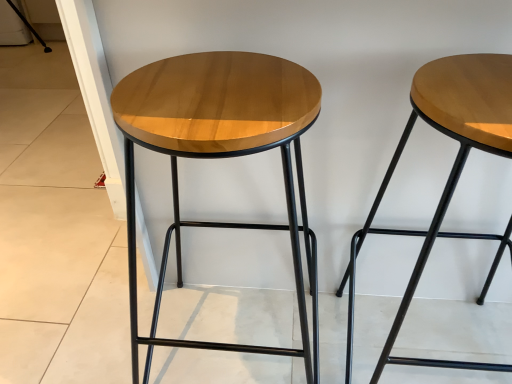
What do you see at coordinates (450, 173) in the screenshot? Image resolution: width=512 pixels, height=384 pixels. I see `wooden stool at upper right, acting as the 2th stool starting from the left` at bounding box center [450, 173].

Find the location of a particular element. wooden stool at upper right, acting as the 2th stool starting from the left is located at coordinates (450, 173).

What is the approximate width of wooden stool at upper right, acting as the 2th stool starting from the left?

15.60 inches.

What is the approximate width of wooden stool at center, arranged as the first stool when viewed from the left?

It is 15.86 inches.

I want to click on wooden stool at center, the 2th stool from the right, so click(x=220, y=153).

Describe the element at coordinates (220, 153) in the screenshot. I see `wooden stool at center, arranged as the first stool when viewed from the left` at that location.

Identify the location of wooden stool at upper right, acting as the 2th stool starting from the left. The height and width of the screenshot is (384, 512). (450, 173).

Which is more to the right, wooden stool at upper right, the 1th stool from the right, or wooden stool at center, the 2th stool from the right?

From the viewer's perspective, wooden stool at upper right, the 1th stool from the right, appears more on the right side.

Considering the relative positions of wooden stool at upper right, acting as the 2th stool starting from the left, and wooden stool at center, arranged as the first stool when viewed from the left, in the image provided, is wooden stool at upper right, acting as the 2th stool starting from the left, in front of wooden stool at center, arranged as the first stool when viewed from the left,?

Yes, it is in front of wooden stool at center, arranged as the first stool when viewed from the left.

Considering the positions of point (372, 207) and point (320, 98), is point (372, 207) closer or farther from the camera than point (320, 98)?

Clearly, point (372, 207) is more distant from the camera than point (320, 98).

From the image's perspective, which one is positioned lower, wooden stool at upper right, the 1th stool from the right, or wooden stool at center, the 2th stool from the right?

From the image's view, wooden stool at upper right, the 1th stool from the right, is below.

From a real-world perspective, which object stands above the other?

wooden stool at center, the 2th stool from the right, is physically above.

Is wooden stool at upper right, the 1th stool from the right, thinner than wooden stool at center, arranged as the first stool when viewed from the left?

Correct, the width of wooden stool at upper right, the 1th stool from the right, is less than that of wooden stool at center, arranged as the first stool when viewed from the left.

Can you confirm if wooden stool at upper right, the 1th stool from the right, is shorter than wooden stool at center, the 2th stool from the right?

Indeed, wooden stool at upper right, the 1th stool from the right, has a lesser height compared to wooden stool at center, the 2th stool from the right.

Looking at the image, does wooden stool at upper right, acting as the 2th stool starting from the left, seem bigger or smaller compared to wooden stool at center, arranged as the first stool when viewed from the left?

In the image, wooden stool at upper right, acting as the 2th stool starting from the left, appears to be smaller than wooden stool at center, arranged as the first stool when viewed from the left.

Which is correct: wooden stool at upper right, acting as the 2th stool starting from the left, is inside wooden stool at center, arranged as the first stool when viewed from the left, or outside of it?

wooden stool at upper right, acting as the 2th stool starting from the left, is spatially situated outside wooden stool at center, arranged as the first stool when viewed from the left.

Does wooden stool at upper right, acting as the 2th stool starting from the left, touch wooden stool at center, the 2th stool from the right?

No, wooden stool at upper right, acting as the 2th stool starting from the left, is not touching wooden stool at center, the 2th stool from the right.

Could you tell me if wooden stool at upper right, acting as the 2th stool starting from the left, is turned towards wooden stool at center, the 2th stool from the right?

No, wooden stool at upper right, acting as the 2th stool starting from the left, is not oriented towards wooden stool at center, the 2th stool from the right.

How different are the orientations of wooden stool at upper right, acting as the 2th stool starting from the left, and wooden stool at center, arranged as the first stool when viewed from the left, in degrees?

The angular difference between wooden stool at upper right, acting as the 2th stool starting from the left, and wooden stool at center, arranged as the first stool when viewed from the left, is 0.000533 degrees.

Where is `stool in front of the wooden stool at center, the 2th stool from the right`? stool in front of the wooden stool at center, the 2th stool from the right is located at coordinates (450, 173).

Is wooden stool at center, the 2th stool from the right, to the left or to the right of wooden stool at upper right, acting as the 2th stool starting from the left, in the image?

From the image, it's evident that wooden stool at center, the 2th stool from the right, is to the left of wooden stool at upper right, acting as the 2th stool starting from the left.

Who is more distant, wooden stool at center, arranged as the first stool when viewed from the left, or wooden stool at upper right, the 1th stool from the right?

wooden stool at center, arranged as the first stool when viewed from the left, is behind.

Is point (150, 129) closer to viewer compared to point (442, 364)?

That is True.

From the image's perspective, between wooden stool at center, the 2th stool from the right, and wooden stool at upper right, acting as the 2th stool starting from the left, who is located below?

wooden stool at upper right, acting as the 2th stool starting from the left, appears lower in the image.

From a real-world perspective, is wooden stool at center, arranged as the first stool when viewed from the left, located higher than wooden stool at upper right, acting as the 2th stool starting from the left?

Correct, in the physical world, wooden stool at center, arranged as the first stool when viewed from the left, is higher than wooden stool at upper right, acting as the 2th stool starting from the left.

Is wooden stool at center, the 2th stool from the right, wider or thinner than wooden stool at upper right, the 1th stool from the right?

Considering their sizes, wooden stool at center, the 2th stool from the right, looks broader than wooden stool at upper right, the 1th stool from the right.

Considering the relative sizes of wooden stool at center, the 2th stool from the right, and wooden stool at upper right, acting as the 2th stool starting from the left, in the image provided, is wooden stool at center, the 2th stool from the right, shorter than wooden stool at upper right, acting as the 2th stool starting from the left,?

Incorrect, the height of wooden stool at center, the 2th stool from the right, does not fall short of that of wooden stool at upper right, acting as the 2th stool starting from the left.

Who is bigger, wooden stool at center, arranged as the first stool when viewed from the left, or wooden stool at upper right, the 1th stool from the right?

Bigger between the two is wooden stool at center, arranged as the first stool when viewed from the left.

Is wooden stool at center, arranged as the first stool when viewed from the left, positioned beyond the bounds of wooden stool at upper right, acting as the 2th stool starting from the left?

That's correct, wooden stool at center, arranged as the first stool when viewed from the left, is outside of wooden stool at upper right, acting as the 2th stool starting from the left.

Could you tell me if wooden stool at center, arranged as the first stool when viewed from the left, is turned towards wooden stool at upper right, the 1th stool from the right?

No.

Locate an element on the screen. The image size is (512, 384). stool in front of the wooden stool at center, the 2th stool from the right is located at coordinates pyautogui.click(x=450, y=173).

Find the location of a particular element. The image size is (512, 384). stool behind the wooden stool at upper right, the 1th stool from the right is located at coordinates (220, 153).

Where is `stool located below the wooden stool at center, arranged as the first stool when viewed from the left (from the image's perspective)`? The height and width of the screenshot is (384, 512). stool located below the wooden stool at center, arranged as the first stool when viewed from the left (from the image's perspective) is located at coordinates (450, 173).